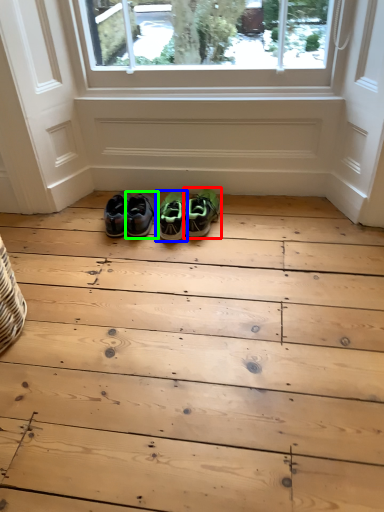
Question: Which is farther away from footwear (highlighted by a red box)? footwear (highlighted by a blue box) or footwear (highlighted by a green box)?

Choices:
 (A) footwear
 (B) footwear

Answer: (B)